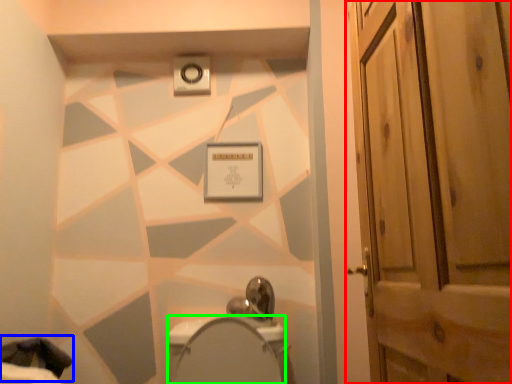
Question: Which object is positioned closest to door (highlighted by a red box)? Select from laundry (highlighted by a blue box) and bidet (highlighted by a green box).

Choices:
 (A) laundry
 (B) bidet

Answer: (B)